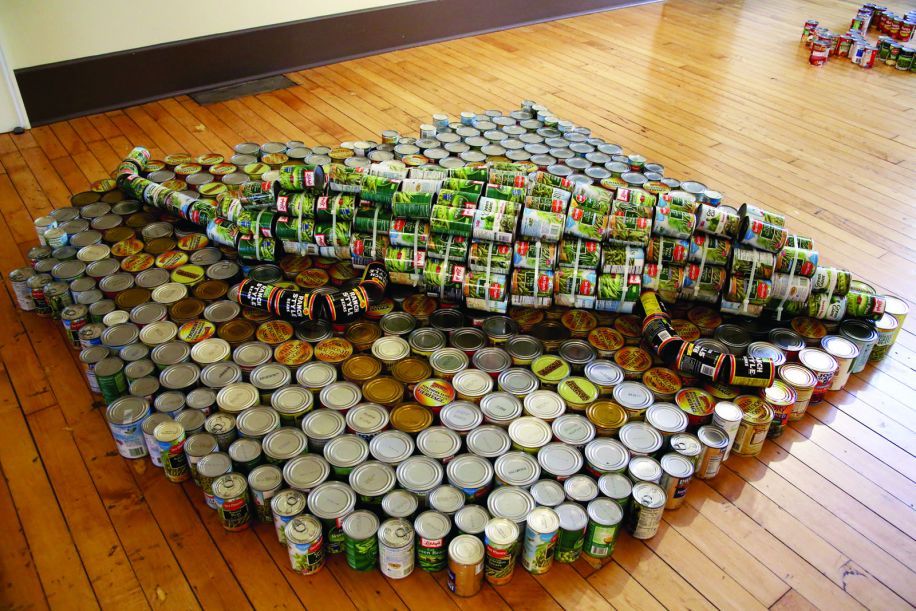
Find the location of a particular element. Image resolution: width=916 pixels, height=611 pixels. vent is located at coordinates (234, 84).